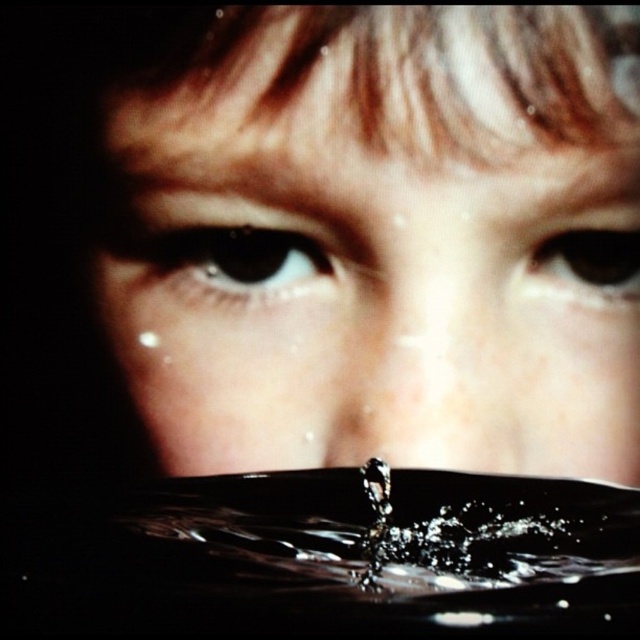
Question: Can you confirm if brown glossy eye at center is positioned to the left of brown glossy eye at upper right?

Choices:
 (A) no
 (B) yes

Answer: (B)

Question: Does smooth skin face at center have a greater width compared to brown glossy eye at upper right?

Choices:
 (A) yes
 (B) no

Answer: (A)

Question: Considering the real-world distances, which object is farthest from the brown glossy eye at center?

Choices:
 (A) smooth skin face at center
 (B) brown glossy eye at upper right

Answer: (B)

Question: Which point is closer to the camera?

Choices:
 (A) smooth skin face at center
 (B) brown glossy eye at center

Answer: (A)

Question: Is smooth skin face at center positioned at the back of brown glossy eye at upper right?

Choices:
 (A) yes
 (B) no

Answer: (B)

Question: Which object is positioned closest to the brown glossy eye at upper right?

Choices:
 (A) smooth skin face at center
 (B) brown glossy eye at center

Answer: (A)